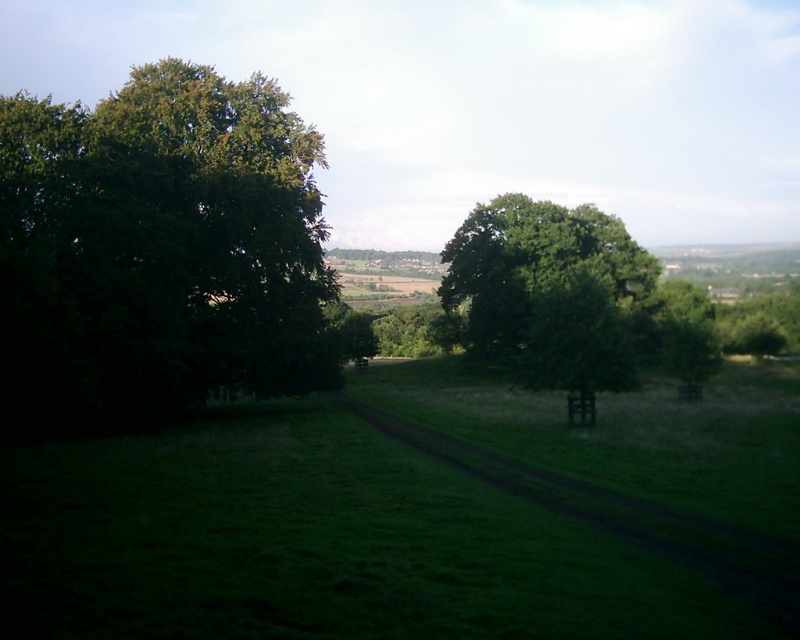
Question: From the image, what is the correct spatial relationship of green grass at left in relation to green leafy tree at left?

Choices:
 (A) below
 (B) above

Answer: (A)

Question: Does green grass at left have a greater width compared to green leafy tree at center?

Choices:
 (A) yes
 (B) no

Answer: (A)

Question: Which object appears closest to the camera in this image?

Choices:
 (A) green leafy tree at left
 (B) green grass at left
 (C) green leafy tree at center

Answer: (B)

Question: Which point is farther from the camera taking this photo?

Choices:
 (A) (24, 332)
 (B) (541, 234)

Answer: (B)

Question: Which object appears closest to the camera in this image?

Choices:
 (A) green leafy tree at center
 (B) green grass at left

Answer: (B)

Question: Is green grass at left closer to the viewer compared to green leafy tree at left?

Choices:
 (A) yes
 (B) no

Answer: (A)